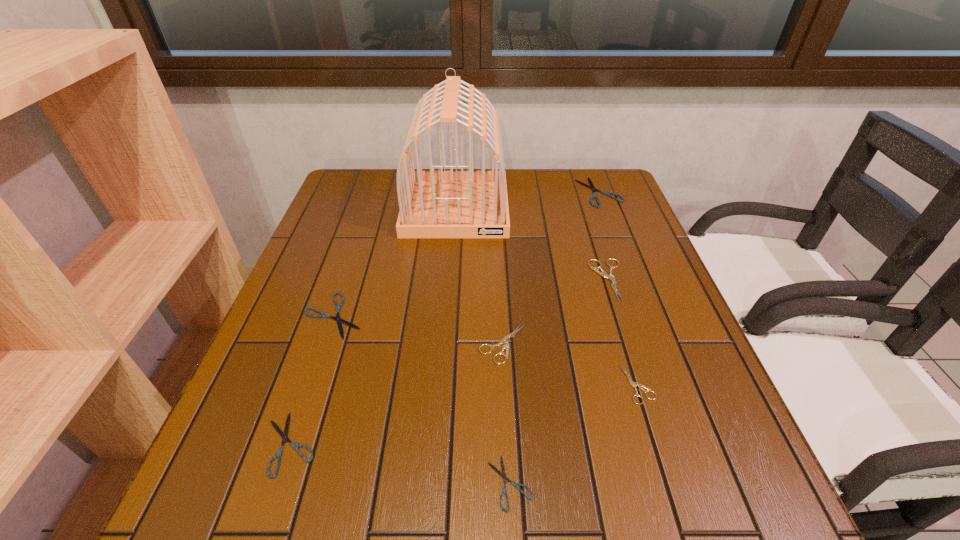
At what (x,y) coordinates should I click in order to perform the action: click on the fifth farthest shears. Please return your answer as a coordinate pair (x, y). The image size is (960, 540). Looking at the image, I should click on (632, 383).

You are a GUI agent. You are given a task and a screenshot of the screen. Output one action in this format:
    pyautogui.click(x=<x>, y=<y>)
    Task: Click on the second smallest black shears
    Image resolution: width=960 pixels, height=540 pixels.
    Given the screenshot: What is the action you would take?
    pyautogui.click(x=284, y=435)

Locate an element on the screen. the shortest object is located at coordinates (503, 474).

Where is `the shortest shears`? The height and width of the screenshot is (540, 960). the shortest shears is located at coordinates (503, 474).

This screenshot has width=960, height=540. I want to click on blank space located with an open door on the tallest object, so click(x=449, y=298).

Locate an element on the screen. free location located on the front of the farthest beige shears is located at coordinates (628, 342).

The image size is (960, 540). In order to click on free space located on the left of the farthest shears in this screenshot , I will do `click(517, 192)`.

Identify the location of free point located 0.180m on the back of the second nearest beige shears. This screenshot has height=540, width=960. [499, 270].

This screenshot has width=960, height=540. In order to click on vacant area located on the front of the second farthest black shears in this screenshot , I will do `click(268, 511)`.

Locate an element on the screen. This screenshot has width=960, height=540. free space located on the back of the third nearest shears is located at coordinates (602, 268).